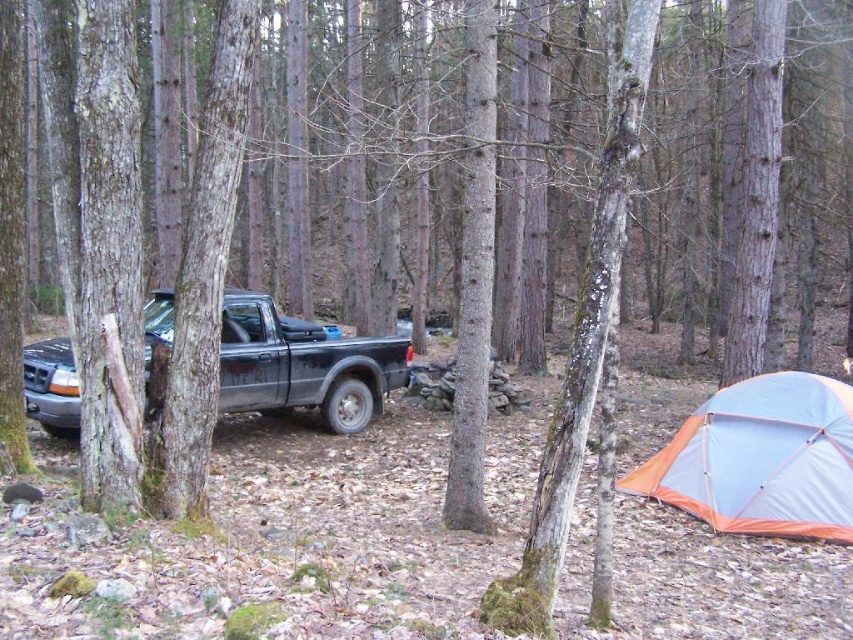
You are a hiker planning to set up camp in this forest scene. You see the orange fabric tent at lower right and the matte black truck at left. Which object is closer to the ground?

The orange fabric tent at lower right is closer to the ground because it is positioned under the matte black truck at left, which is elevated higher.

You are standing at the point marked as point (x=761, y=458) in the image, which is the orange fabric tent at lower right. You want to walk towards the black pickup truck parked among the trees. Which direction should you move to reach the truck?

The orange fabric tent at lower right is located at point (x=761, y=458). To reach the black pickup truck parked among the trees, you should move towards the upper left direction since the truck is positioned in that area relative to the tent.

You are a hiker planning to set up camp near the orange fabric tent at lower right and the matte black truck at left. Based on the scene, which object is located to the right of the other?

The orange fabric tent at lower right is positioned on the right side of matte black truck at left.